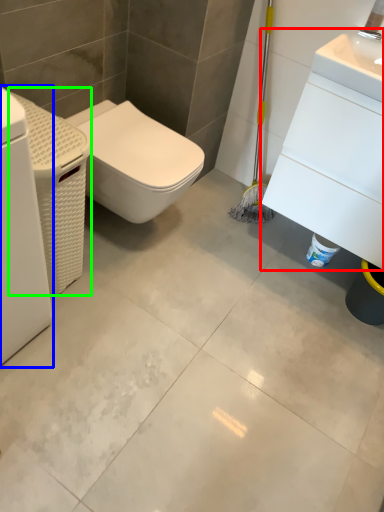
Question: Which object is the closest to the porcelain (highlighted by a red box)? Choose among these: washing machine (highlighted by a blue box) or porcelain (highlighted by a green box).

Choices:
 (A) washing machine
 (B) porcelain

Answer: (B)